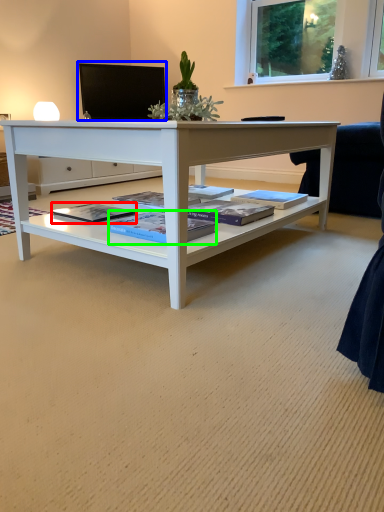
Question: Which object is positioned closest to magazine (highlighted by a red box)? Select from computer monitor (highlighted by a blue box) and magazine (highlighted by a green box).

Choices:
 (A) computer monitor
 (B) magazine

Answer: (B)